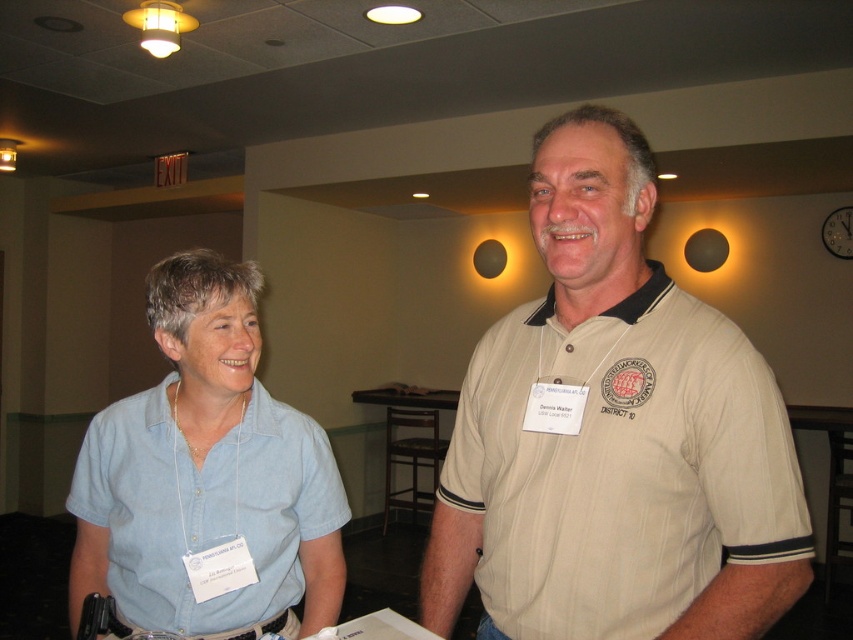
Does beige striped polo shirt at center appear under light blue shirt at left?

No, beige striped polo shirt at center is not below light blue shirt at left.

Describe the element at coordinates (614, 436) in the screenshot. I see `beige striped polo shirt at center` at that location.

The width and height of the screenshot is (853, 640). Identify the location of beige striped polo shirt at center. (614, 436).